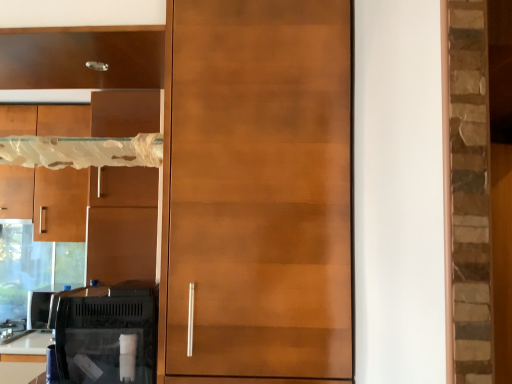
Where is `matte wood cabinet at upper left, the 2th cabinetry in the bottom-to-top sequence`? The width and height of the screenshot is (512, 384). matte wood cabinet at upper left, the 2th cabinetry in the bottom-to-top sequence is located at coordinates (81, 58).

Find the location of a particular element. The image size is (512, 384). matte brown cabinet at left, the 1th cabinetry positioned from the back is located at coordinates (60, 204).

From the picture: In terms of width, does glossy wood door at center look wider or thinner when compared to matte brown cabinet at left, positioned as the second cabinetry in top-to-bottom order?

Clearly, glossy wood door at center has more width compared to matte brown cabinet at left, positioned as the second cabinetry in top-to-bottom order.

Can you see glossy wood door at center touching matte brown cabinet at left, positioned as the first cabinetry in left-to-right order?

glossy wood door at center is not next to matte brown cabinet at left, positioned as the first cabinetry in left-to-right order, and they're not touching.

From a real-world perspective, is glossy wood door at center above or below matte brown cabinet at left, which appears as the second cabinetry when viewed from the right?

glossy wood door at center is below matte brown cabinet at left, which appears as the second cabinetry when viewed from the right.

In terms of width, does matte wood cabinet at upper left, the first cabinetry viewed from the top, look wider or thinner when compared to glossy wood door at center?

matte wood cabinet at upper left, the first cabinetry viewed from the top, is thinner than glossy wood door at center.

Is matte wood cabinet at upper left, acting as the second cabinetry starting from the left, taller or shorter than glossy wood door at center?

Clearly, matte wood cabinet at upper left, acting as the second cabinetry starting from the left, is shorter compared to glossy wood door at center.

From the image's perspective, which is above, matte brown cabinet at left, which is counted as the first cabinetry, starting from the bottom, or glossy wood door at center?

From the image's view, glossy wood door at center is above.

Which of these two, matte brown cabinet at left, which appears as the second cabinetry when viewed from the right, or glossy wood door at center, stands taller?

glossy wood door at center is taller.

Can you confirm if matte brown cabinet at left, which appears as the second cabinetry when viewed from the right, is bigger than glossy wood door at center?

Incorrect, matte brown cabinet at left, which appears as the second cabinetry when viewed from the right, is not larger than glossy wood door at center.

Is the surface of matte wood cabinet at upper left, acting as the second cabinetry starting from the left, in direct contact with matte brown cabinet at left, the 1th cabinetry positioned from the back?

matte wood cabinet at upper left, acting as the second cabinetry starting from the left, and matte brown cabinet at left, the 1th cabinetry positioned from the back, are not in contact.

Is matte wood cabinet at upper left, the 2th cabinetry in the bottom-to-top sequence, inside or outside of matte brown cabinet at left, positioned as the first cabinetry in left-to-right order?

matte wood cabinet at upper left, the 2th cabinetry in the bottom-to-top sequence, lies outside matte brown cabinet at left, positioned as the first cabinetry in left-to-right order.

Can you confirm if matte wood cabinet at upper left, the first cabinetry viewed from the top, is positioned to the right of matte brown cabinet at left, which appears as the second cabinetry when viewed from the right?

Indeed, matte wood cabinet at upper left, the first cabinetry viewed from the top, is positioned on the right side of matte brown cabinet at left, which appears as the second cabinetry when viewed from the right.

From the image's perspective, is matte wood cabinet at upper left, the 1th cabinetry positioned from the right, positioned above or below matte brown cabinet at left, which appears as the second cabinetry when viewed from the right?

matte wood cabinet at upper left, the 1th cabinetry positioned from the right, is situated higher than matte brown cabinet at left, which appears as the second cabinetry when viewed from the right, in the image.

Are glossy wood door at center and matte wood cabinet at upper left, placed as the second cabinetry when sorted from back to front, located far from each other?

No, glossy wood door at center is not far away from matte wood cabinet at upper left, placed as the second cabinetry when sorted from back to front.

From the picture: From a real-world perspective, who is located higher, glossy wood door at center or matte wood cabinet at upper left, acting as the second cabinetry starting from the left?

matte wood cabinet at upper left, acting as the second cabinetry starting from the left, is physically above.

I want to click on cabinetry that is the 1st one when counting backward from the glossy wood door at center, so click(x=81, y=58).

Visually, is matte brown cabinet at left, which is counted as the first cabinetry, starting from the bottom, positioned to the left or to the right of matte wood cabinet at upper left, placed as the second cabinetry when sorted from back to front?

Clearly, matte brown cabinet at left, which is counted as the first cabinetry, starting from the bottom, is on the left of matte wood cabinet at upper left, placed as the second cabinetry when sorted from back to front, in the image.

Which object is closer to the camera, matte brown cabinet at left, which is counted as the first cabinetry, starting from the bottom, or matte wood cabinet at upper left, the first cabinetry viewed from the top?

matte wood cabinet at upper left, the first cabinetry viewed from the top, is closer to the camera.

From the image's perspective, would you say matte brown cabinet at left, positioned as the first cabinetry in left-to-right order, is shown under matte wood cabinet at upper left, acting as the second cabinetry starting from the left?

Indeed, from the image's perspective, matte brown cabinet at left, positioned as the first cabinetry in left-to-right order, is shown beneath matte wood cabinet at upper left, acting as the second cabinetry starting from the left.

Consider the image. Is matte brown cabinet at left, positioned as the second cabinetry in top-to-bottom order, spatially inside matte wood cabinet at upper left, the first cabinetry viewed from the top, or outside of it?

matte brown cabinet at left, positioned as the second cabinetry in top-to-bottom order, is not enclosed by matte wood cabinet at upper left, the first cabinetry viewed from the top.

At what (x,y) coordinates should I click in order to perform the action: click on door lying above the matte brown cabinet at left, which is counted as the first cabinetry, starting from the bottom (from the image's perspective). Please return your answer as a coordinate pair (x, y). Looking at the image, I should click on (260, 190).

Identify the location of cabinetry that is the 1st one when counting backward from the glossy wood door at center. (81, 58).

Estimate the real-world distances between objects in this image. Which object is closer to glossy wood door at center, matte wood cabinet at upper left, the first cabinetry viewed from the top, or matte brown cabinet at left, which appears as the second cabinetry when viewed from the right?

matte wood cabinet at upper left, the first cabinetry viewed from the top.

Consider the image. Looking at the image, which one is located further to matte brown cabinet at left, which is counted as the first cabinetry, starting from the bottom, matte wood cabinet at upper left, acting as the second cabinetry starting from the left, or glossy wood door at center?

The object further to matte brown cabinet at left, which is counted as the first cabinetry, starting from the bottom, is glossy wood door at center.

Considering their positions, is matte brown cabinet at left, positioned as the second cabinetry in top-to-bottom order, positioned closer to glossy wood door at center than matte wood cabinet at upper left, placed as the second cabinetry when sorted from back to front?

Among the two, matte wood cabinet at upper left, placed as the second cabinetry when sorted from back to front, is located nearer to glossy wood door at center.

Which object lies nearer to the anchor point matte wood cabinet at upper left, the 1th cabinetry positioned from the right, glossy wood door at center or matte brown cabinet at left, positioned as the first cabinetry in left-to-right order?

glossy wood door at center lies closer to matte wood cabinet at upper left, the 1th cabinetry positioned from the right, than the other object.

When comparing their distances from matte brown cabinet at left, which appears as the second cabinetry when viewed from the right, does glossy wood door at center or matte wood cabinet at upper left, placed as the second cabinetry when sorted from back to front, seem further?

The object further to matte brown cabinet at left, which appears as the second cabinetry when viewed from the right, is glossy wood door at center.

Which object lies nearer to the anchor point matte wood cabinet at upper left, placed as the second cabinetry when sorted from back to front, matte brown cabinet at left, which appears as the second cabinetry when viewed from the right, or glossy wood door at center?

glossy wood door at center is closer to matte wood cabinet at upper left, placed as the second cabinetry when sorted from back to front.

Locate an element on the screen. The image size is (512, 384). cabinetry located between glossy wood door at center and matte brown cabinet at left, which is counted as the first cabinetry, starting from the bottom, in the depth direction is located at coordinates (81, 58).